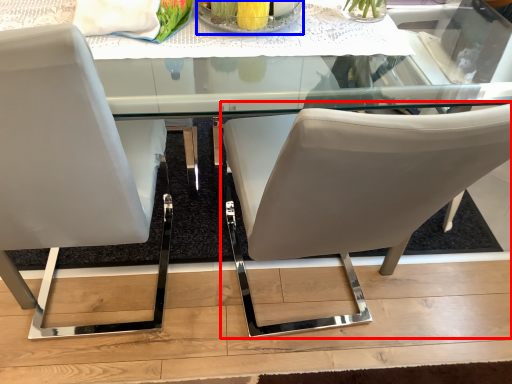
Question: Which object is further to the camera taking this photo, chair (highlighted by a red box) or glass plate (highlighted by a blue box)?

Choices:
 (A) chair
 (B) glass plate

Answer: (B)